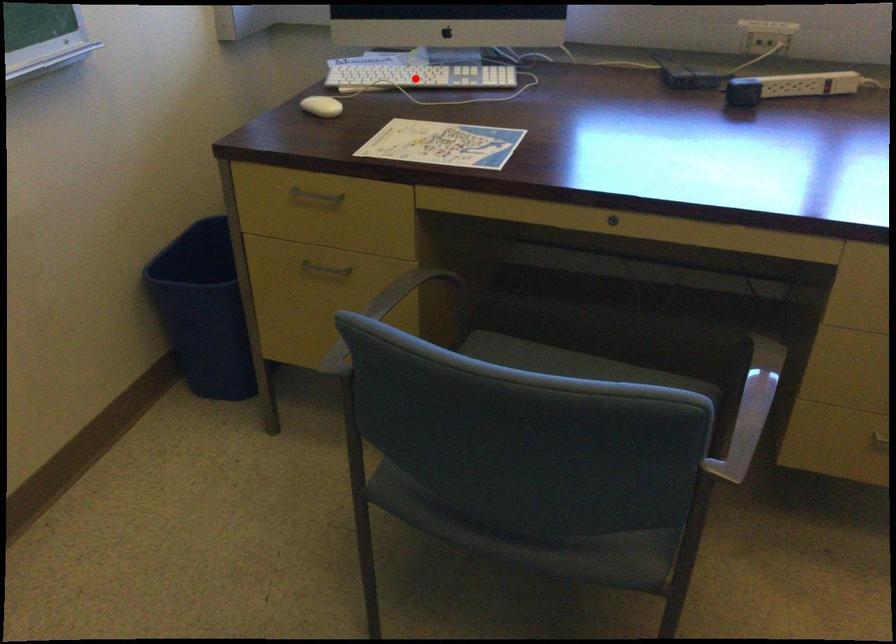
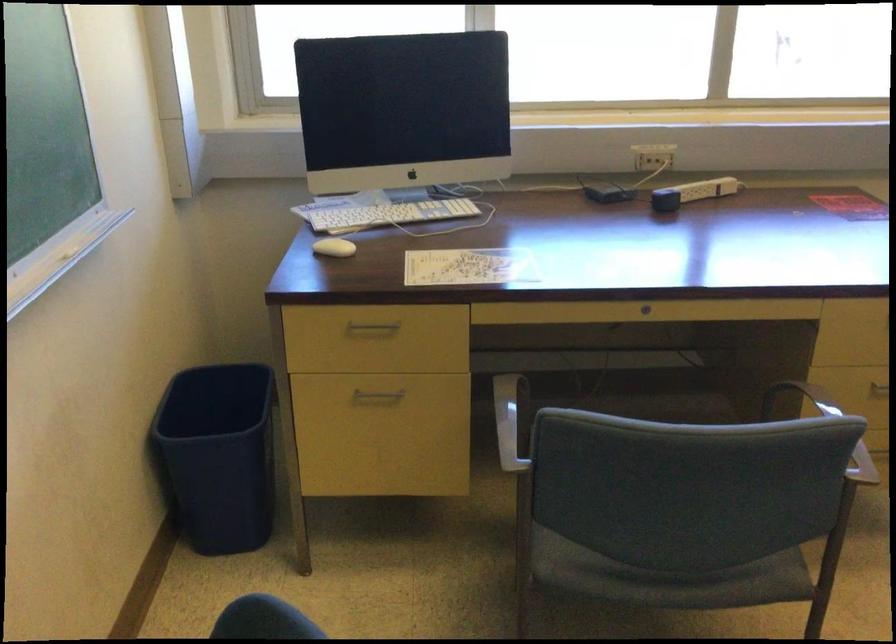
The point at the highlighted location is marked in the first image. Where is the corresponding point in the second image?

(389, 214)